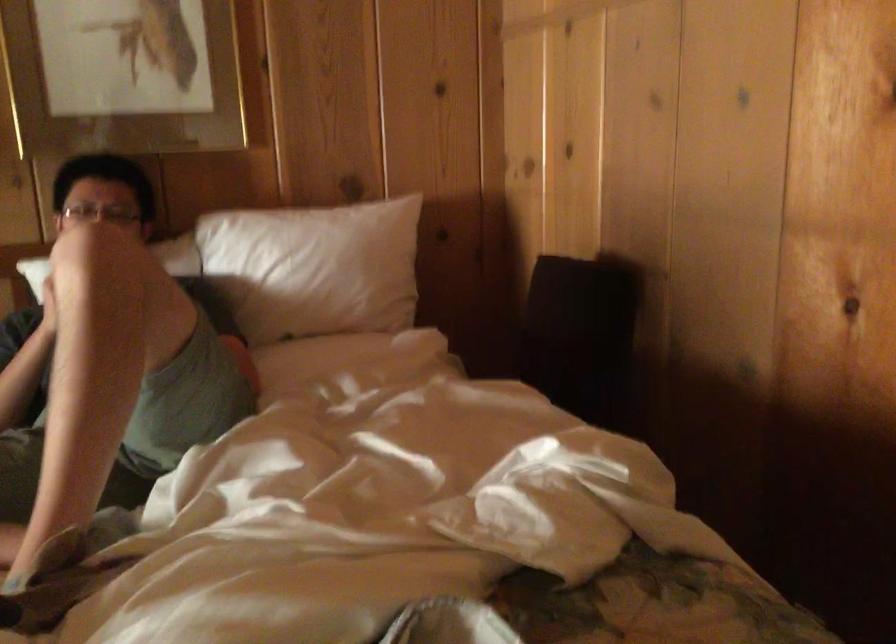
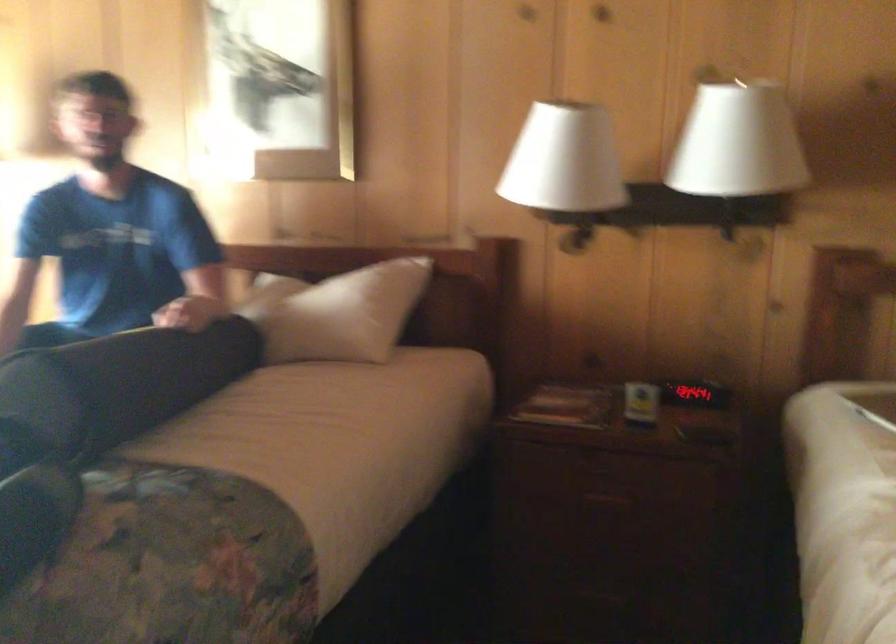
Question: The camera is either moving clockwise (left) or counter-clockwise (right) around the object. The first image is from the beginning of the video and the second image is from the end. Is the camera moving left or right when shooting the video?

Choices:
 (A) Left
 (B) Right

Answer: (B)